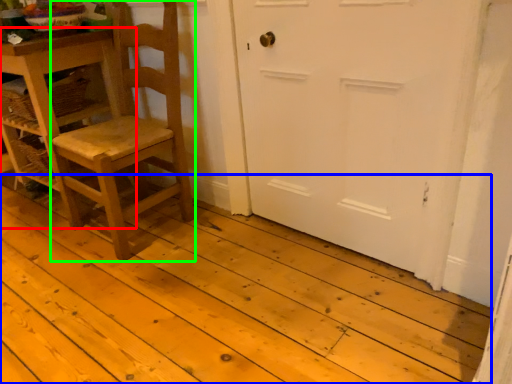
Question: Which object is the farthest from table (highlighted by a red box)? Choose among these: plank (highlighted by a blue box) or chair (highlighted by a green box).

Choices:
 (A) plank
 (B) chair

Answer: (A)